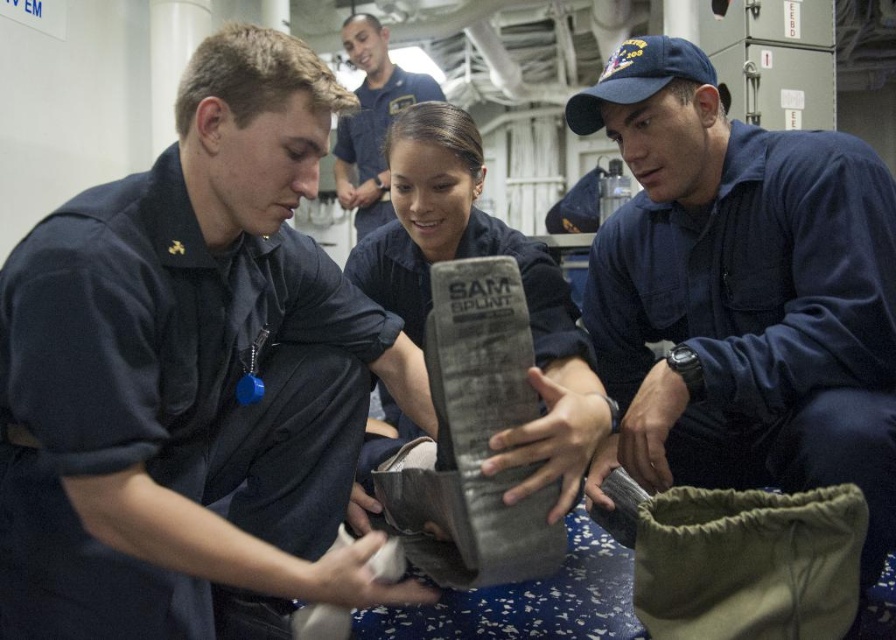
Question: Which of the following is the farthest from the observer?

Choices:
 (A) (601, 125)
 (B) (360, 102)
 (C) (478, 189)
 (D) (342, 308)

Answer: (B)

Question: Does matte black uniform at center appear over navy blue uniform at center?

Choices:
 (A) no
 (B) yes

Answer: (A)

Question: Is matte black uniform at center bigger than matte gray splint at center?

Choices:
 (A) yes
 (B) no

Answer: (B)

Question: Which object is positioned closest to the matte gray splint at center?

Choices:
 (A) navy blue uniform at center
 (B) matte black uniform at center

Answer: (A)

Question: Is matte gray splint at center smaller than blue uniform shirt at upper center?

Choices:
 (A) yes
 (B) no

Answer: (B)

Question: Which object is positioned closest to the matte black uniform at center?

Choices:
 (A) navy blue uniform at center
 (B) matte gray splint at center

Answer: (B)